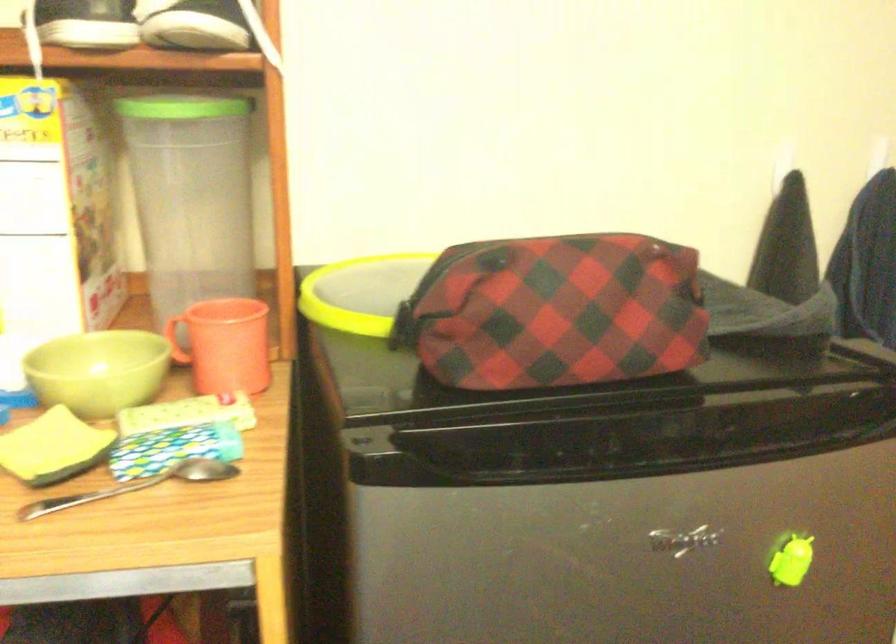
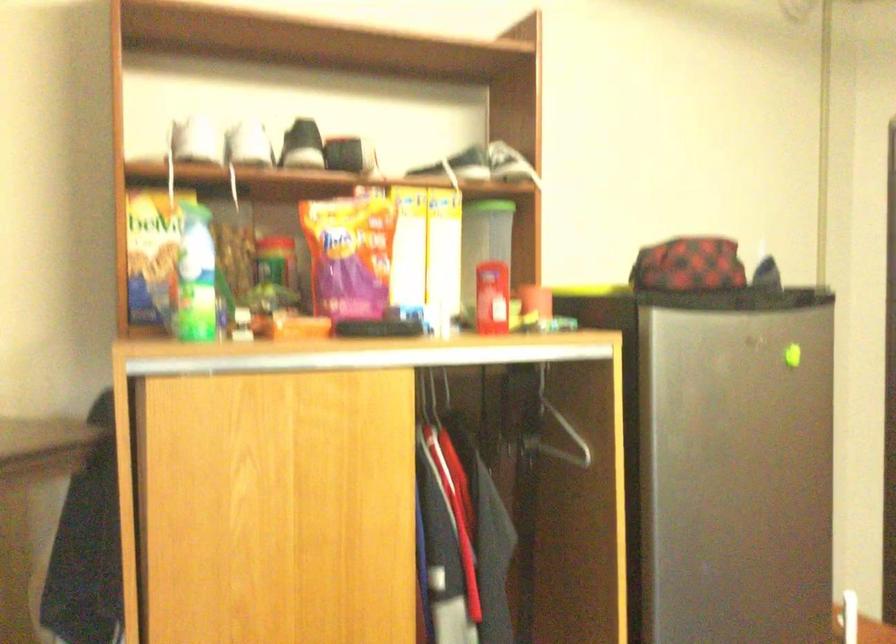
In a continuous first-person perspective shot, in which direction is the camera moving?

The cameraman moved toward left, backward.